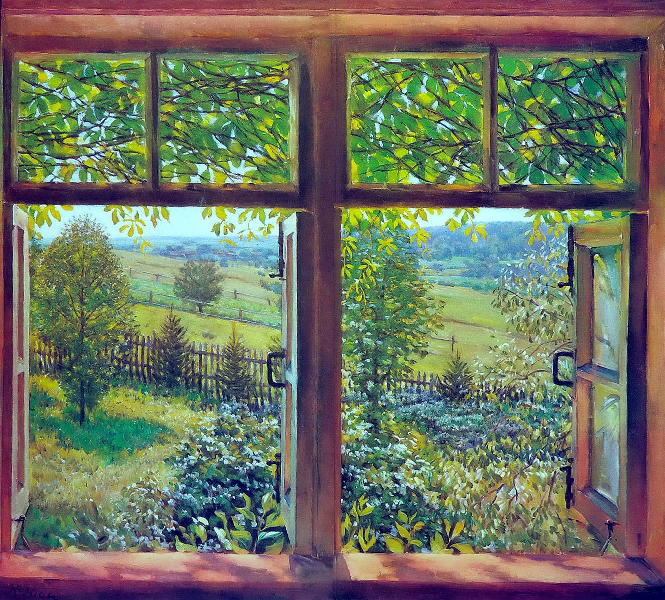
The image size is (665, 600). Identify the location of black latch. (569, 272), (568, 486), (274, 471), (281, 265).